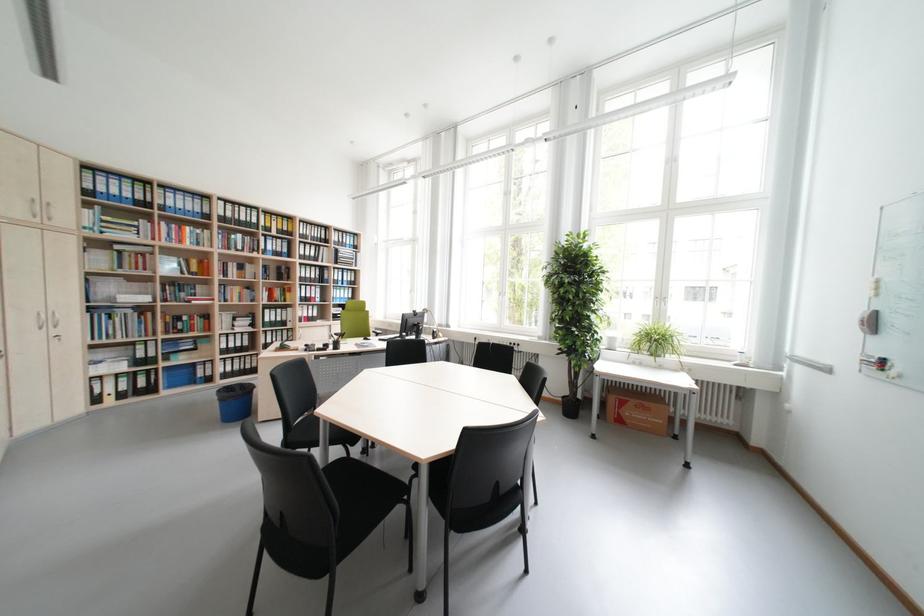
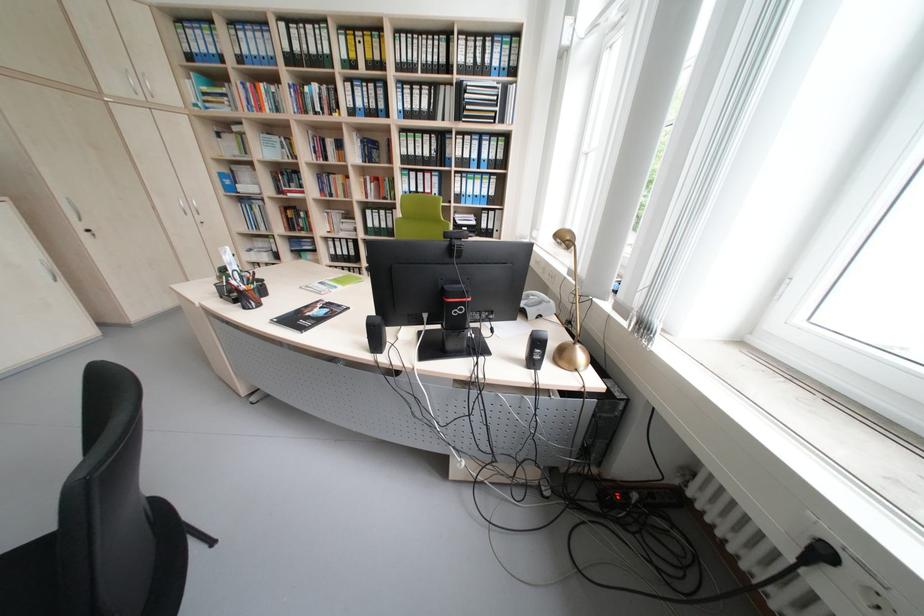
Question: I am providing you with two images of the same scene from different viewpoints. After the viewpoint changes to image2, which objects are now occluded?

Choices:
 (A) black webcam
 (B) black ring binder
 (C) black pen holder
 (D) none of these

Answer: (D)